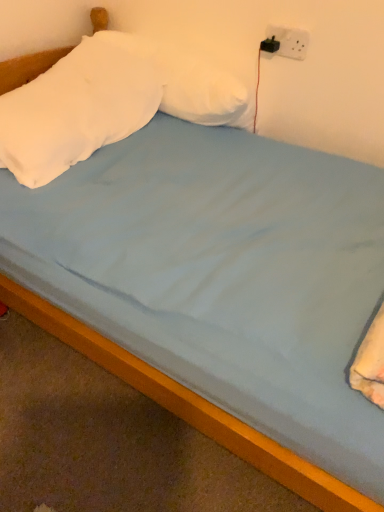
The image size is (384, 512). I want to click on white plastic socket at upper right, so click(x=286, y=42).

Locate an element on the screen. The height and width of the screenshot is (512, 384). white soft pillow at upper center, the 2th pillow positioned from the left is located at coordinates (190, 82).

Is white soft pillow at upper center, acting as the 1th pillow starting from the right, inside the boundaries of white plastic socket at upper right, or outside?

white soft pillow at upper center, acting as the 1th pillow starting from the right, lies outside white plastic socket at upper right.

Does white soft pillow at upper center, acting as the 1th pillow starting from the right, lie in front of white plastic socket at upper right?

Yes, it is in front of white plastic socket at upper right.

This screenshot has width=384, height=512. I want to click on the 1st pillow positioned below the white plastic socket at upper right (from a real-world perspective), so click(190, 82).

Consider the image. Does white soft pillow at upper center, acting as the 1th pillow starting from the right, contain white soft pillow at upper left, the 1th pillow when ordered from left to right?

No, white soft pillow at upper center, acting as the 1th pillow starting from the right, does not contain white soft pillow at upper left, the 1th pillow when ordered from left to right.

Is white soft pillow at upper center, the 2th pillow positioned from the left, shorter than white soft pillow at upper left, the 1th pillow when ordered from left to right?

In fact, white soft pillow at upper center, the 2th pillow positioned from the left, may be taller than white soft pillow at upper left, the 1th pillow when ordered from left to right.

Is point (165, 73) farther from camera compared to point (95, 46)?

That is True.

Is white soft pillow at upper left, which is the 2th pillow from right to left, at the back of white soft pillow at upper center, acting as the 1th pillow starting from the right?

white soft pillow at upper center, acting as the 1th pillow starting from the right, is not turned away from white soft pillow at upper left, which is the 2th pillow from right to left.

Does white soft pillow at upper left, which is the 2th pillow from right to left, have a lesser width compared to white soft pillow at upper center, the 2th pillow positioned from the left?

In fact, white soft pillow at upper left, which is the 2th pillow from right to left, might be wider than white soft pillow at upper center, the 2th pillow positioned from the left.

Is white soft pillow at upper left, which is the 2th pillow from right to left, situated inside white soft pillow at upper center, the 2th pillow positioned from the left, or outside?

white soft pillow at upper left, which is the 2th pillow from right to left, cannot be found inside white soft pillow at upper center, the 2th pillow positioned from the left.

How distant is white soft pillow at upper left, the 1th pillow when ordered from left to right, from white soft pillow at upper center, acting as the 1th pillow starting from the right?

They are 8.40 inches apart.

From the image's perspective, which one is positioned higher, white soft pillow at upper left, the 1th pillow when ordered from left to right, or white plastic socket at upper right?

white plastic socket at upper right is shown above in the image.

From a real-world perspective, which object rests below the other?

white soft pillow at upper left, which is the 2th pillow from right to left.

Is white soft pillow at upper left, which is the 2th pillow from right to left, situated inside white plastic socket at upper right or outside?

white soft pillow at upper left, which is the 2th pillow from right to left, is located beyond the bounds of white plastic socket at upper right.

The height and width of the screenshot is (512, 384). I want to click on the 2nd pillow in front of the white plastic socket at upper right, starting your count from the anchor, so click(78, 106).

Could you measure the distance between white plastic socket at upper right and white soft pillow at upper center, acting as the 1th pillow starting from the right?

white plastic socket at upper right is 11.16 inches away from white soft pillow at upper center, acting as the 1th pillow starting from the right.

Can you see white plastic socket at upper right touching white soft pillow at upper center, acting as the 1th pillow starting from the right?

No, white plastic socket at upper right is not beside white soft pillow at upper center, acting as the 1th pillow starting from the right.

Who is smaller, white plastic socket at upper right or white soft pillow at upper center, the 2th pillow positioned from the left?

Smaller between the two is white plastic socket at upper right.

Who is shorter, white plastic socket at upper right or white soft pillow at upper center, acting as the 1th pillow starting from the right?

white plastic socket at upper right is shorter.

Consider the image. Is wooden bed frame at lower center shorter than white plastic socket at upper right?

Yes, wooden bed frame at lower center is shorter than white plastic socket at upper right.

Which is closer, (68,328) or (304,36)?

Clearly, point (68,328) is closer to the camera than point (304,36).

Is wooden bed frame at lower center far away from white plastic socket at upper right?

Yes, wooden bed frame at lower center and white plastic socket at upper right are quite far apart.

Considering their positions, is wooden bed frame at lower center located in front of or behind white plastic socket at upper right?

wooden bed frame at lower center is positioned closer to the viewer than white plastic socket at upper right.

Locate an element on the screen. Image resolution: width=384 pixels, height=512 pixels. bed frame located on the right of white soft pillow at upper left, the 1th pillow when ordered from left to right is located at coordinates (190, 406).

Based on their sizes in the image, would you say wooden bed frame at lower center is bigger or smaller than white soft pillow at upper left, which is the 2th pillow from right to left?

wooden bed frame at lower center is smaller than white soft pillow at upper left, which is the 2th pillow from right to left.

Is wooden bed frame at lower center spatially inside white soft pillow at upper left, the 1th pillow when ordered from left to right, or outside of it?

wooden bed frame at lower center is not inside white soft pillow at upper left, the 1th pillow when ordered from left to right, it's outside.

Is wooden bed frame at lower center at the right side of white soft pillow at upper left, which is the 2th pillow from right to left?

Yes, wooden bed frame at lower center is to the right of white soft pillow at upper left, which is the 2th pillow from right to left.

From the white plastic socket at upper right, count the 1st pillow to the left and point to it. Please provide its 2D coordinates.

[(190, 82)]

Locate an element on the screen. The height and width of the screenshot is (512, 384). pillow behind the white soft pillow at upper left, which is the 2th pillow from right to left is located at coordinates (190, 82).

Considering their positions, is white plastic socket at upper right positioned closer to wooden bed frame at lower center than white soft pillow at upper center, acting as the 1th pillow starting from the right?

Among the two, white soft pillow at upper center, acting as the 1th pillow starting from the right, is located nearer to wooden bed frame at lower center.

Looking at the image, which one is located further to white soft pillow at upper center, the 2th pillow positioned from the left, white plastic socket at upper right or wooden bed frame at lower center?

Based on the image, wooden bed frame at lower center appears to be further to white soft pillow at upper center, the 2th pillow positioned from the left.

Consider the image. Which object lies nearer to the anchor point wooden bed frame at lower center, white soft pillow at upper center, the 2th pillow positioned from the left, or white plastic socket at upper right?

white soft pillow at upper center, the 2th pillow positioned from the left, is closer to wooden bed frame at lower center.

Looking at the image, which one is located closer to wooden bed frame at lower center, white soft pillow at upper left, which is the 2th pillow from right to left, or white soft pillow at upper center, the 2th pillow positioned from the left?

white soft pillow at upper left, which is the 2th pillow from right to left.

Considering their positions, is white soft pillow at upper center, the 2th pillow positioned from the left, positioned closer to white plastic socket at upper right than white soft pillow at upper left, the 1th pillow when ordered from left to right?

Based on the image, white soft pillow at upper center, the 2th pillow positioned from the left, appears to be nearer to white plastic socket at upper right.

Which object lies nearer to the anchor point wooden bed frame at lower center, white plastic socket at upper right or white soft pillow at upper left, the 1th pillow when ordered from left to right?

The object closer to wooden bed frame at lower center is white soft pillow at upper left, the 1th pillow when ordered from left to right.

Looking at the image, which one is located further to wooden bed frame at lower center, white soft pillow at upper left, which is the 2th pillow from right to left, or white plastic socket at upper right?

white plastic socket at upper right is further to wooden bed frame at lower center.

When comparing their distances from white soft pillow at upper center, acting as the 1th pillow starting from the right, does white soft pillow at upper left, which is the 2th pillow from right to left, or wooden bed frame at lower center seem closer?

white soft pillow at upper left, which is the 2th pillow from right to left, is positioned closer to the anchor white soft pillow at upper center, acting as the 1th pillow starting from the right.

Where is `pillow between white soft pillow at upper left, which is the 2th pillow from right to left, and white plastic socket at upper right from left to right`? The image size is (384, 512). pillow between white soft pillow at upper left, which is the 2th pillow from right to left, and white plastic socket at upper right from left to right is located at coordinates (190, 82).

Find the location of a particular element. This screenshot has width=384, height=512. pillow between white soft pillow at upper center, the 2th pillow positioned from the left, and wooden bed frame at lower center vertically is located at coordinates (78, 106).